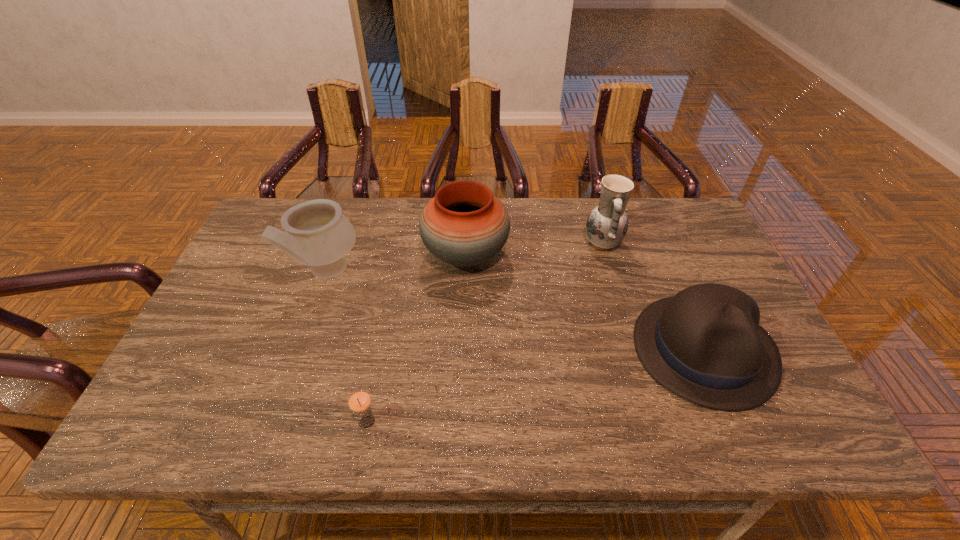
Find the location of `object that is the third closest one to the leftmost object`. object that is the third closest one to the leftmost object is located at coordinates (607, 224).

At what (x,y) coordinates should I click in order to perform the action: click on pottery that stands as the second closest to the fourth object from right to left. Please return your answer as a coordinate pair (x, y). Image resolution: width=960 pixels, height=540 pixels. Looking at the image, I should click on (464, 225).

This screenshot has width=960, height=540. I want to click on pottery that stands as the closest to the leftmost object, so click(464, 225).

Locate an element on the screen. Image resolution: width=960 pixels, height=540 pixels. free point that satisfies the following two spatial constraints: 1. on the back side of the third object from left to right; 2. on the left side of the shortest object is located at coordinates (398, 255).